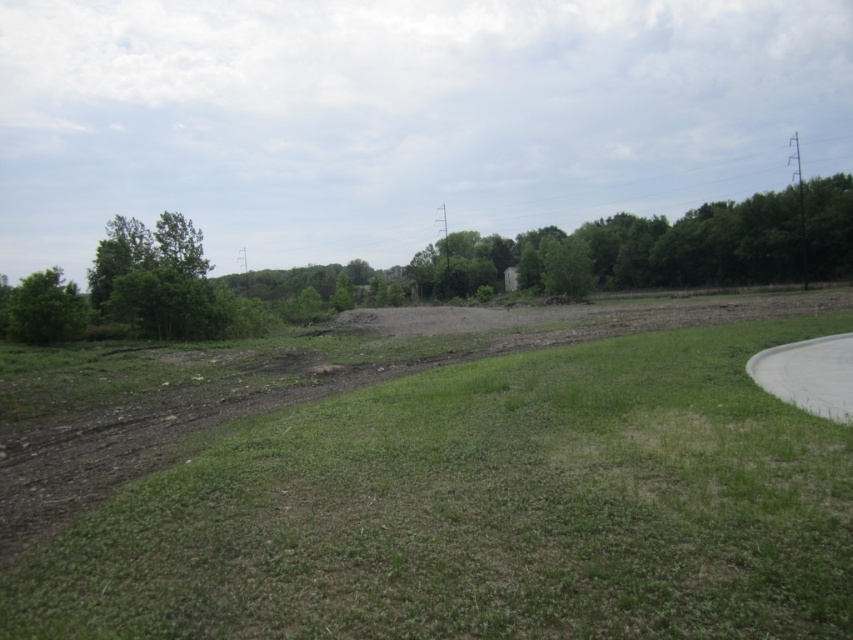
Which is above, green grass at center or green leafy tree at left?

green leafy tree at left

Identify the location of green grass at center. This screenshot has width=853, height=640. (482, 509).